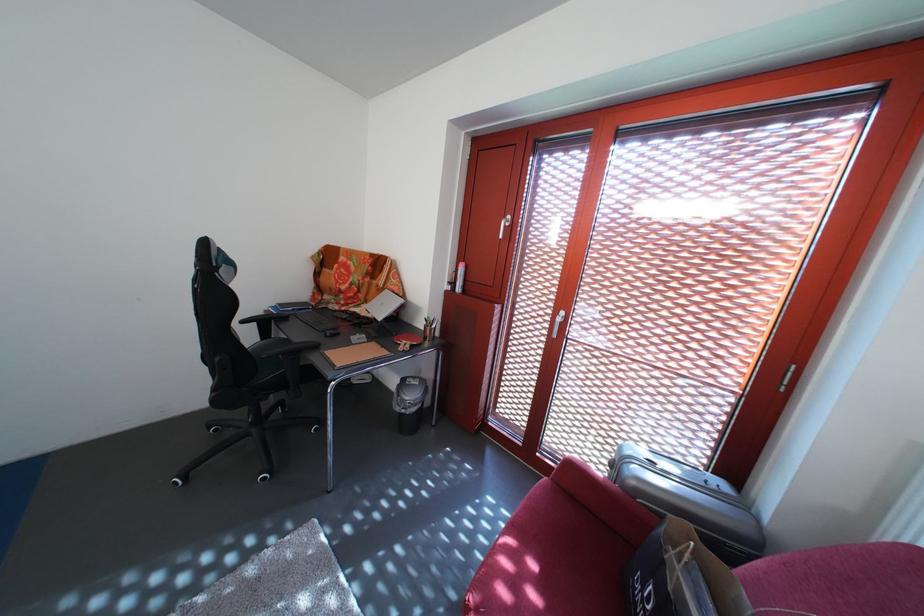
Find where to sit the sofa sitting surface. Please return your answer as a coordinate pair (x, y).

(549, 565)